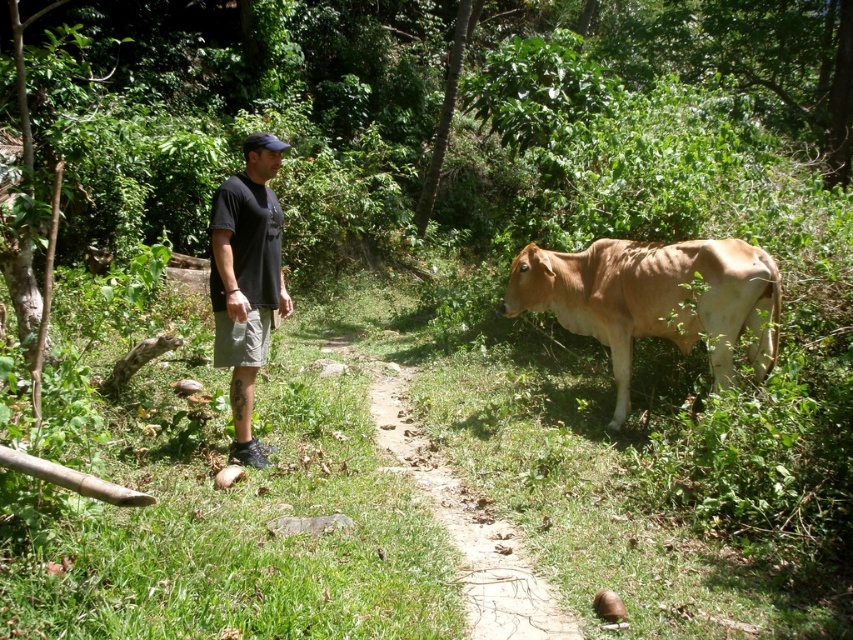
Question: Does brown smooth cow at right come behind green grassy trail at center?

Choices:
 (A) yes
 (B) no

Answer: (A)

Question: Estimate the real-world distances between objects in this image. Which object is closer to the green grassy trail at center?

Choices:
 (A) brown smooth cow at right
 (B) black cotton t-shirt at center

Answer: (B)

Question: Is brown smooth cow at right further to the viewer compared to green grassy trail at center?

Choices:
 (A) no
 (B) yes

Answer: (B)

Question: Which is farther from the brown smooth cow at right?

Choices:
 (A) green grassy trail at center
 (B) black cotton t-shirt at center

Answer: (B)

Question: Is brown smooth cow at right positioned at the back of black cotton t-shirt at center?

Choices:
 (A) yes
 (B) no

Answer: (A)

Question: Which point is closer to the camera?

Choices:
 (A) [769, 333]
 (B) [228, 333]
 (C) [485, 544]

Answer: (C)